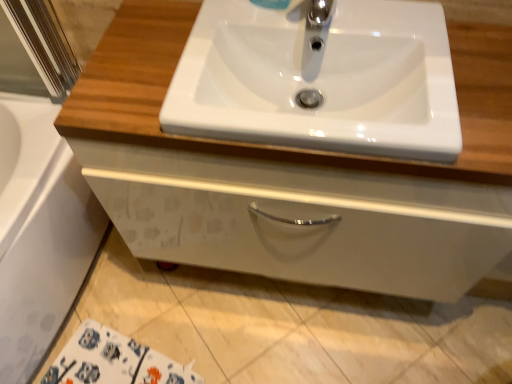
Image resolution: width=512 pixels, height=384 pixels. What do you see at coordinates (315, 20) in the screenshot?
I see `chrome metallic faucet at upper center` at bounding box center [315, 20].

This screenshot has width=512, height=384. I want to click on white glossy cabinet at center, so click(x=288, y=162).

Locate an element on the screen. The height and width of the screenshot is (384, 512). chrome metallic faucet at upper center is located at coordinates tap(315, 20).

From a real-world perspective, which is physically below, chrome metallic faucet at upper center or white glossy sink at center?

white glossy sink at center, from a real-world perspective.

Can you tell me how much chrome metallic faucet at upper center and white glossy sink at center differ in facing direction?

The angular difference between chrome metallic faucet at upper center and white glossy sink at center is 1.36 degrees.

Is chrome metallic faucet at upper center shorter than white glossy sink at center?

In fact, chrome metallic faucet at upper center may be taller than white glossy sink at center.

From the image's perspective, is chrome metallic faucet at upper center located above or below white glossy sink at center?

From the image's perspective, chrome metallic faucet at upper center appears above white glossy sink at center.

Which is behind, white glossy sink at center or white glossy bath at lower left?

white glossy bath at lower left is further from the camera.

Is white glossy sink at center directly adjacent to white glossy bath at lower left?

They are not placed beside each other.

Considering the positions of point (320, 132) and point (75, 283), is point (320, 132) closer or farther from the camera than point (75, 283)?

Point (320, 132).

From a real-world perspective, does chrome metallic faucet at upper center stand above white glossy bath at lower left?

Yes, from a real-world perspective, chrome metallic faucet at upper center is on top of white glossy bath at lower left.

Locate an element on the screen. The width and height of the screenshot is (512, 384). plumbing fixture lying above the white glossy bath at lower left (from the image's perspective) is located at coordinates (315, 20).

From the image's perspective, does chrome metallic faucet at upper center appear lower than white glossy bath at lower left?

No.

Is chrome metallic faucet at upper center taller or shorter than white glossy bath at lower left?

In the image, chrome metallic faucet at upper center appears to be shorter than white glossy bath at lower left.

Is white glossy bath at lower left facing towards white glossy sink at center?

No, white glossy bath at lower left is not oriented towards white glossy sink at center.

Would you say white glossy bath at lower left is outside white glossy sink at center?

Yes, white glossy bath at lower left is not within white glossy sink at center.

From the image's perspective, relative to white glossy sink at center, is white glossy bath at lower left above or below?

Clearly, from the image's perspective, white glossy bath at lower left is below white glossy sink at center.

From the image's perspective, is white glossy cabinet at center below white glossy sink at center?

Indeed, from the image's perspective, white glossy cabinet at center is shown beneath white glossy sink at center.

At what (x,y) coordinates should I click in order to perform the action: click on bathroom cabinet located below the white glossy sink at center (from the image's perspective). Please return your answer as a coordinate pair (x, y). This screenshot has width=512, height=384. Looking at the image, I should click on (288, 162).

Between point (450, 246) and point (395, 64), which one is positioned behind?

The point (450, 246) is farther.

From the image's perspective, which one is positioned lower, chrome metallic faucet at upper center or white glossy cabinet at center?

white glossy cabinet at center, from the image's perspective.

From a real-world perspective, is chrome metallic faucet at upper center on white glossy cabinet at center?

Yes, from a real-world perspective, chrome metallic faucet at upper center is over white glossy cabinet at center

Which is in front, chrome metallic faucet at upper center or white glossy cabinet at center?

white glossy cabinet at center is closer to the camera.

Which is more to the right, chrome metallic faucet at upper center or white glossy cabinet at center?

Positioned to the right is white glossy cabinet at center.

Considering the positions of objects white glossy bath at lower left and white glossy cabinet at center in the image provided, who is more to the left, white glossy bath at lower left or white glossy cabinet at center?

white glossy bath at lower left is more to the left.

Is white glossy bath at lower left beside white glossy cabinet at center?

white glossy bath at lower left and white glossy cabinet at center are clearly separated.

From a real-world perspective, is white glossy bath at lower left located beneath white glossy cabinet at center?

Yes, from a real-world perspective, white glossy bath at lower left is beneath white glossy cabinet at center.

Can you confirm if white glossy bath at lower left is thinner than white glossy cabinet at center?

No.

The width and height of the screenshot is (512, 384). I want to click on plumbing fixture located behind the white glossy sink at center, so click(315, 20).

In order to click on bath that appears below the white glossy sink at center (from a real-world perspective) in this screenshot , I will do `click(39, 232)`.

Which object lies further to the anchor point white glossy sink at center, white glossy bath at lower left or white glossy cabinet at center?

Among the two, white glossy bath at lower left is located further to white glossy sink at center.

Based on their spatial positions, is white glossy bath at lower left or white glossy sink at center closer to white glossy cabinet at center?

white glossy sink at center is closer to white glossy cabinet at center.

Which object lies further to the anchor point white glossy cabinet at center, white glossy sink at center or white glossy bath at lower left?

Based on the image, white glossy bath at lower left appears to be further to white glossy cabinet at center.

When comparing their distances from chrome metallic faucet at upper center, does white glossy bath at lower left or white glossy cabinet at center seem further?

Based on the image, white glossy bath at lower left appears to be further to chrome metallic faucet at upper center.

Which object lies further to the anchor point white glossy sink at center, chrome metallic faucet at upper center or white glossy bath at lower left?

white glossy bath at lower left is further to white glossy sink at center.

Based on the photo, based on their spatial positions, is chrome metallic faucet at upper center or white glossy sink at center further from white glossy bath at lower left?

chrome metallic faucet at upper center.

Which object lies nearer to the anchor point white glossy bath at lower left, chrome metallic faucet at upper center or white glossy cabinet at center?

white glossy cabinet at center lies closer to white glossy bath at lower left than the other object.

Looking at the image, which one is located closer to chrome metallic faucet at upper center, white glossy bath at lower left or white glossy sink at center?

white glossy sink at center is positioned closer to the anchor chrome metallic faucet at upper center.

Identify the location of sink between chrome metallic faucet at upper center and white glossy cabinet at center in the up-down direction. (320, 79).

Identify the location of sink between white glossy bath at lower left and chrome metallic faucet at upper center in the horizontal direction. The height and width of the screenshot is (384, 512). (320, 79).

Image resolution: width=512 pixels, height=384 pixels. I want to click on sink situated between white glossy bath at lower left and white glossy cabinet at center from left to right, so click(x=320, y=79).

What are the coordinates of `plumbing fixture between white glossy bath at lower left and white glossy cabinet at center from left to right` in the screenshot? It's located at (315, 20).